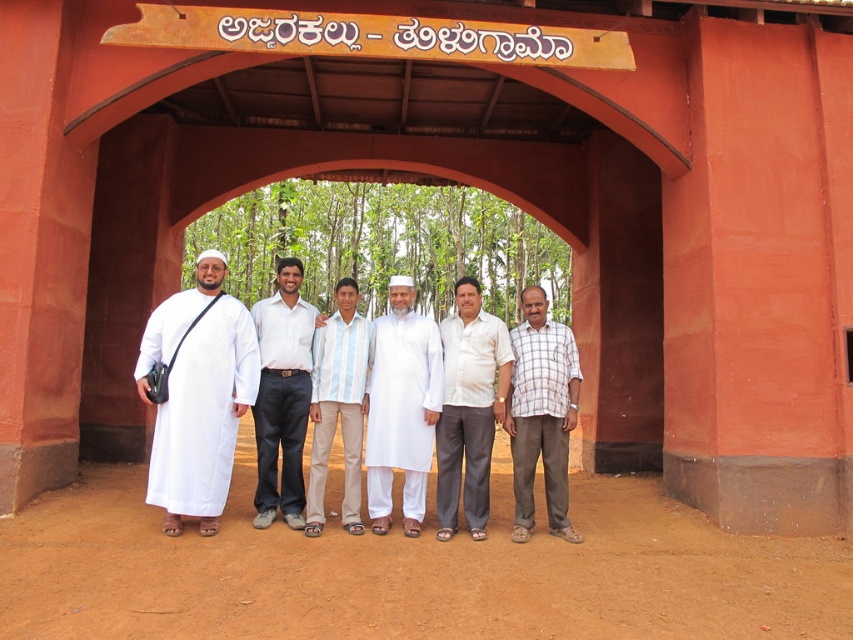
Is plaid cotton shirt at center closer to camera compared to striped cotton shirt at center?

No, it is not.

What do you see at coordinates (541, 413) in the screenshot? This screenshot has width=853, height=640. I see `plaid cotton shirt at center` at bounding box center [541, 413].

Does point (515, 515) come behind point (347, 518)?

Yes, it is behind point (347, 518).

Image resolution: width=853 pixels, height=640 pixels. I want to click on plaid cotton shirt at center, so click(541, 413).

In the scene shown: Does white matte/soft fabric at center appear on the right side of striped cotton shirt at center?

Incorrect, white matte/soft fabric at center is not on the right side of striped cotton shirt at center.

Does white matte/soft fabric at center have a larger size compared to striped cotton shirt at center?

Yes, white matte/soft fabric at center is bigger than striped cotton shirt at center.

The width and height of the screenshot is (853, 640). Describe the element at coordinates (196, 396) in the screenshot. I see `white matte/soft fabric at center` at that location.

You are a GUI agent. You are given a task and a screenshot of the screen. Output one action in this format:
    pyautogui.click(x=<x>, y=<y>)
    Task: Click on the white matte/soft fabric at center
    The height and width of the screenshot is (640, 853).
    Given the screenshot: What is the action you would take?
    pyautogui.click(x=196, y=396)

Does white cotton kurta at center appear on the left side of white cotton shirt at center?

Incorrect, white cotton kurta at center is not on the left side of white cotton shirt at center.

Who is higher up, white cotton kurta at center or white cotton shirt at center?

Positioned higher is white cotton shirt at center.

Does point (401, 429) come farther from viewer compared to point (280, 420)?

No, it is not.

Identify the location of white cotton kurta at center. Image resolution: width=853 pixels, height=640 pixels. (401, 406).